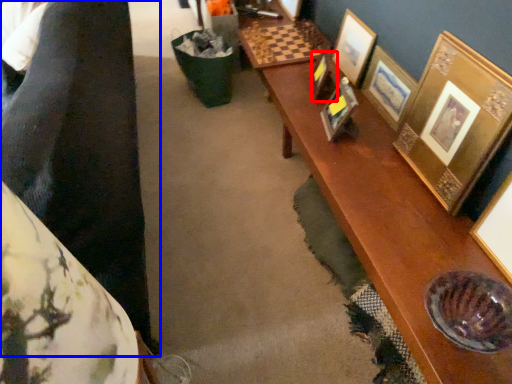
Question: Among these objects, which one is nearest to the camera, picture frame (highlighted by a red box) or couple (highlighted by a blue box)?

Choices:
 (A) picture frame
 (B) couple

Answer: (B)